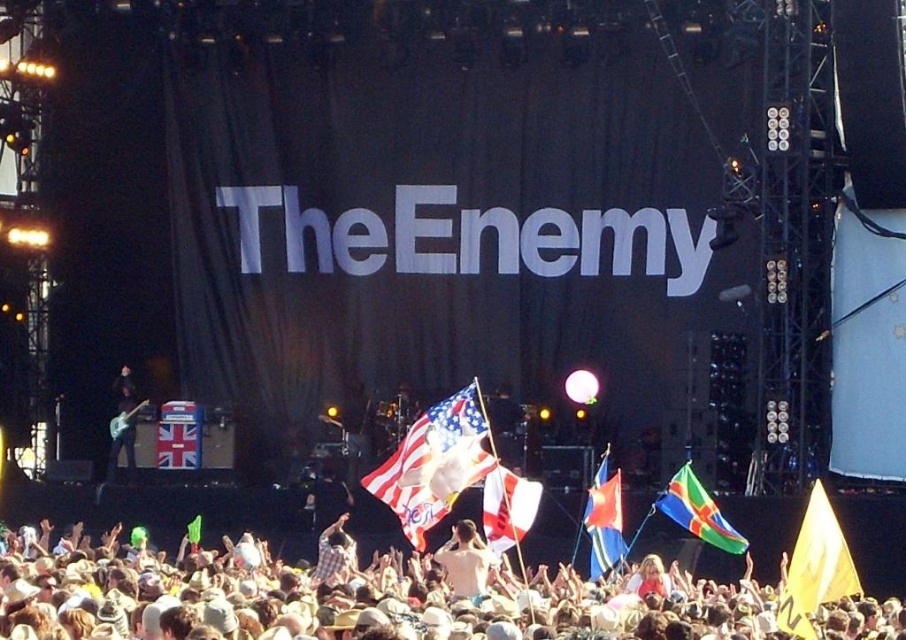
Can you confirm if white fabric flag at center is positioned below shiny black guitar at left?

Correct, white fabric flag at center is located below shiny black guitar at left.

Does white fabric flag at center appear on the left side of shiny black guitar at left?

No, white fabric flag at center is not to the left of shiny black guitar at left.

Is point (504, 520) positioned before point (117, 396)?

Yes, point (504, 520) is closer to viewer.

Where is `white fabric flag at center`? white fabric flag at center is located at coordinates (507, 508).

Is point (249, 557) positioned behind point (410, 536)?

Yes.

At what (x,y) coordinates should I click in order to perform the action: click on white cotton crowd at lower center. Please return your answer as a coordinate pair (x, y). This screenshot has height=640, width=906. Looking at the image, I should click on point(415,596).

Can you confirm if american flag at center is wider than white fabric flag at center?

Indeed, american flag at center has a greater width compared to white fabric flag at center.

Can you confirm if american flag at center is thinner than white fabric flag at center?

Incorrect, american flag at center's width is not less than white fabric flag at center's.

Who is more distant from viewer, (422, 444) or (484, 502)?

The point (422, 444) is more distant.

This screenshot has height=640, width=906. I want to click on american flag at center, so click(434, 464).